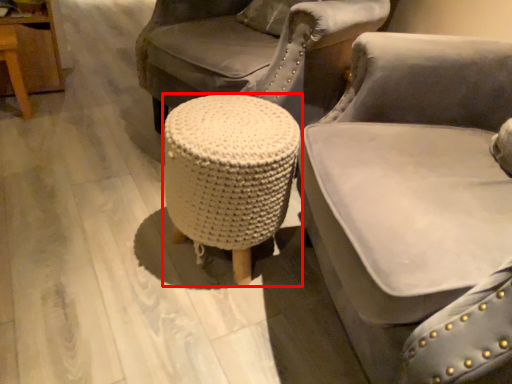
Question: Considering the relative positions of stool (annotated by the red box) and chair in the image provided, where is stool (annotated by the red box) located with respect to the staircase?

Choices:
 (A) right
 (B) left

Answer: (B)